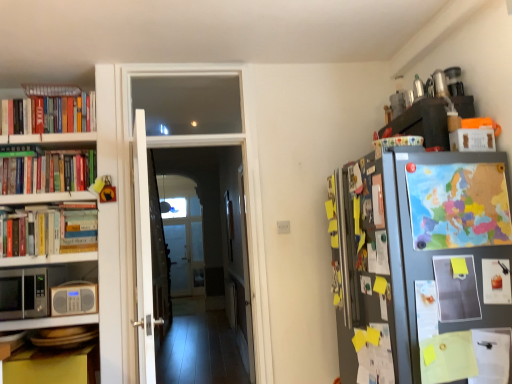
Question: Are hardcover books at left, arranged as the 5th book when viewed from the front, and white paper at right, placed as the first book when sorted from front to back, located far from each other?

Choices:
 (A) no
 (B) yes

Answer: (B)

Question: Is hardcover books at left, the 5th book when ordered from right to left, aimed at white paper at right, which ranks as the 4th book in left-to-right order?

Choices:
 (A) yes
 (B) no

Answer: (B)

Question: Are hardcover books at left, the 5th book when ordered from right to left, and white paper at right, which appears as the 5th book when viewed from the back, beside each other?

Choices:
 (A) no
 (B) yes

Answer: (A)

Question: Can you confirm if hardcover books at left, placed as the first book when sorted from left to right, is shorter than white paper at right, placed as the first book when sorted from front to back?

Choices:
 (A) yes
 (B) no

Answer: (A)

Question: Is hardcover books at left, arranged as the 5th book when viewed from the front, to the left of white paper at right, the second book in the right-to-left sequence, from the viewer's perspective?

Choices:
 (A) no
 (B) yes

Answer: (B)

Question: Is hardcover books at left, arranged as the 5th book when viewed from the front, smaller than white paper at right, which appears as the 5th book when viewed from the back?

Choices:
 (A) yes
 (B) no

Answer: (B)

Question: From a real-world perspective, is black matte microwave at left on top of hardcover books at left, the second book in the left-to-right sequence?

Choices:
 (A) yes
 (B) no

Answer: (B)

Question: Is black matte microwave at left shorter than hardcover books at left, positioned as the fourth book in front-to-back order?

Choices:
 (A) no
 (B) yes

Answer: (B)

Question: From the image's perspective, is black matte microwave at left over hardcover books at left, the second book in the left-to-right sequence?

Choices:
 (A) yes
 (B) no

Answer: (B)

Question: Can you confirm if black matte microwave at left is taller than hardcover books at left, the 2th book when ordered from back to front?

Choices:
 (A) no
 (B) yes

Answer: (A)

Question: Is hardcover books at left, the 4th book viewed from the right, located within black matte microwave at left?

Choices:
 (A) yes
 (B) no

Answer: (B)

Question: Considering the relative sizes of black matte microwave at left and hardcover books at left, the 4th book viewed from the right, in the image provided, is black matte microwave at left wider than hardcover books at left, the 4th book viewed from the right,?

Choices:
 (A) no
 (B) yes

Answer: (B)

Question: Is colorful paper map at right, which appears as the first book when viewed from the right, wider than white paper at right, placed as the first book when sorted from front to back?

Choices:
 (A) yes
 (B) no

Answer: (B)